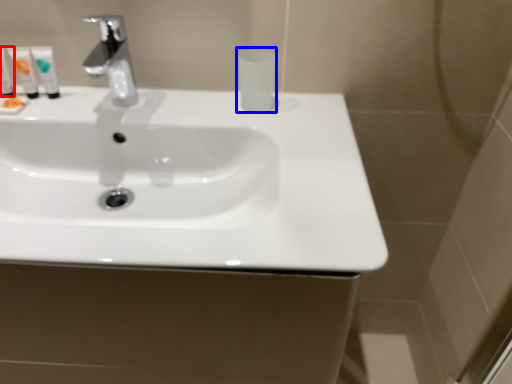
Question: Which object appears farthest to the camera in this image, mouthwash (highlighted by a red box) or mouthwash (highlighted by a blue box)?

Choices:
 (A) mouthwash
 (B) mouthwash

Answer: (A)